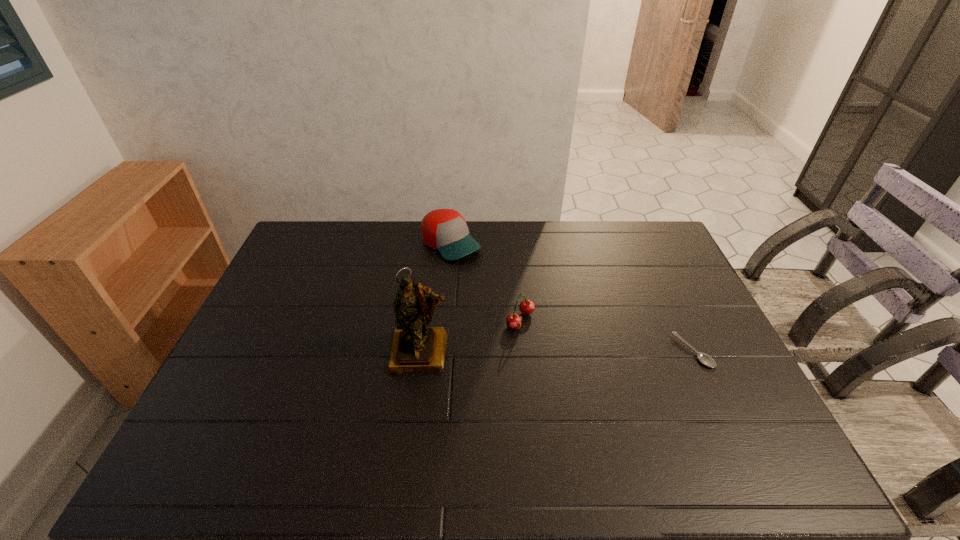
Locate an element on the screen. This screenshot has width=960, height=540. free spot located with stems pointing upwards on the second object from right to left is located at coordinates (658, 394).

Identify the location of vacant space located 0.310m with stems pointing upwards on the second object from right to left. (632, 380).

At what (x,y) coordinates should I click in order to perform the action: click on free space located with stems pointing upwards on the second object from right to left. Please return your answer as a coordinate pair (x, y). Looking at the image, I should click on (654, 392).

At what (x,y) coordinates should I click in order to perform the action: click on object situated at the far edge. Please return your answer as a coordinate pair (x, y). The image size is (960, 540). Looking at the image, I should click on point(445,230).

At what (x,y) coordinates should I click in order to perform the action: click on object situated at the right edge. Please return your answer as a coordinate pair (x, y). Looking at the image, I should click on (705, 359).

Where is `vacant area at the far edge of the desktop`? vacant area at the far edge of the desktop is located at coordinates (519, 242).

This screenshot has width=960, height=540. In the image, there is a desktop. Identify the location of vacant space at the near edge. (419, 424).

Locate an element on the screen. The height and width of the screenshot is (540, 960). free space at the left edge is located at coordinates (288, 334).

Where is `vacant region at the right edge of the desktop`? The image size is (960, 540). vacant region at the right edge of the desktop is located at coordinates (687, 314).

Identify the location of free space at the far right corner of the desktop. The height and width of the screenshot is (540, 960). (635, 242).